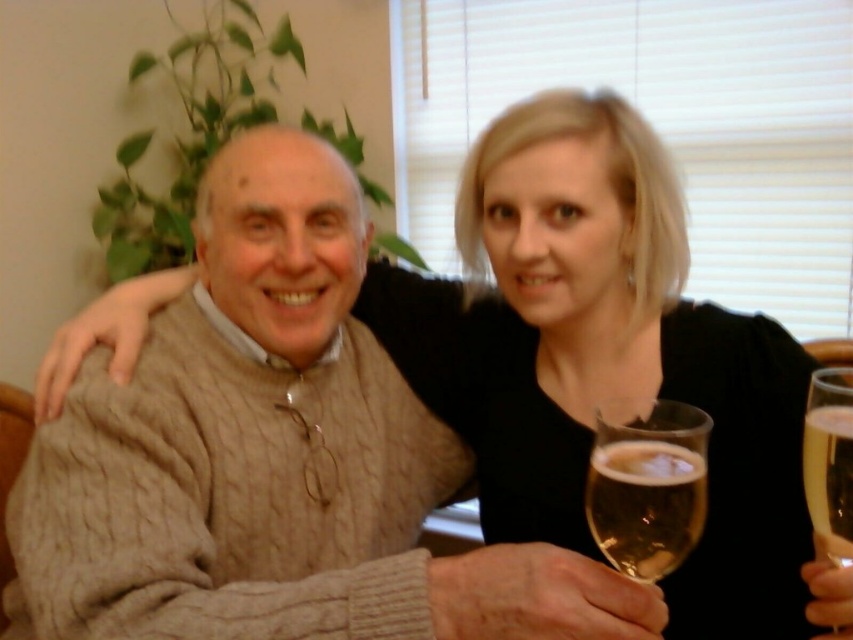
Is translucent glass at lower right wider than clear glass wine glass at right?

In fact, translucent glass at lower right might be narrower than clear glass wine glass at right.

Between translucent glass at lower right and clear glass wine glass at right, which one appears on the left side from the viewer's perspective?

translucent glass at lower right is more to the left.

Is point (614, 561) behind point (836, 422)?

Yes, it is.

The height and width of the screenshot is (640, 853). I want to click on translucent glass at lower right, so click(x=645, y=504).